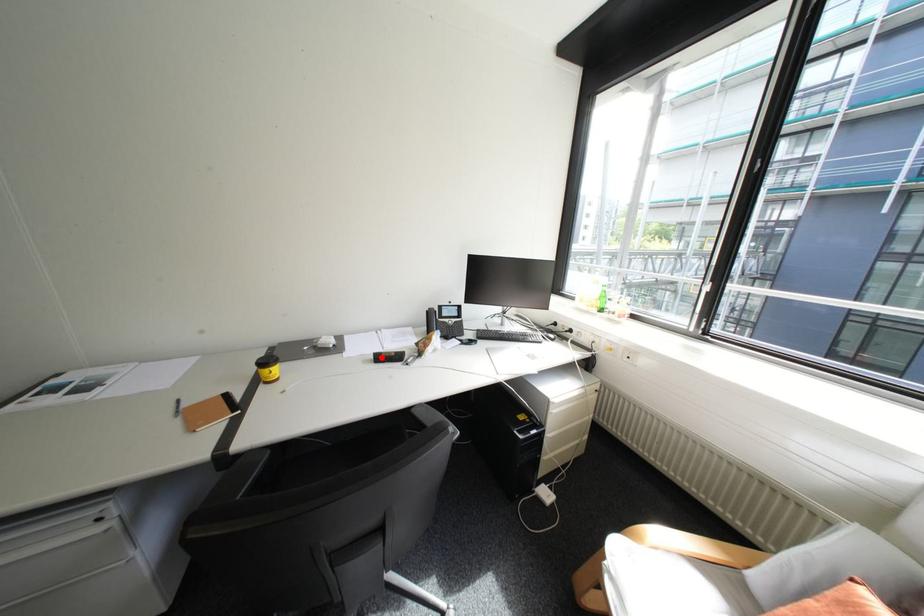
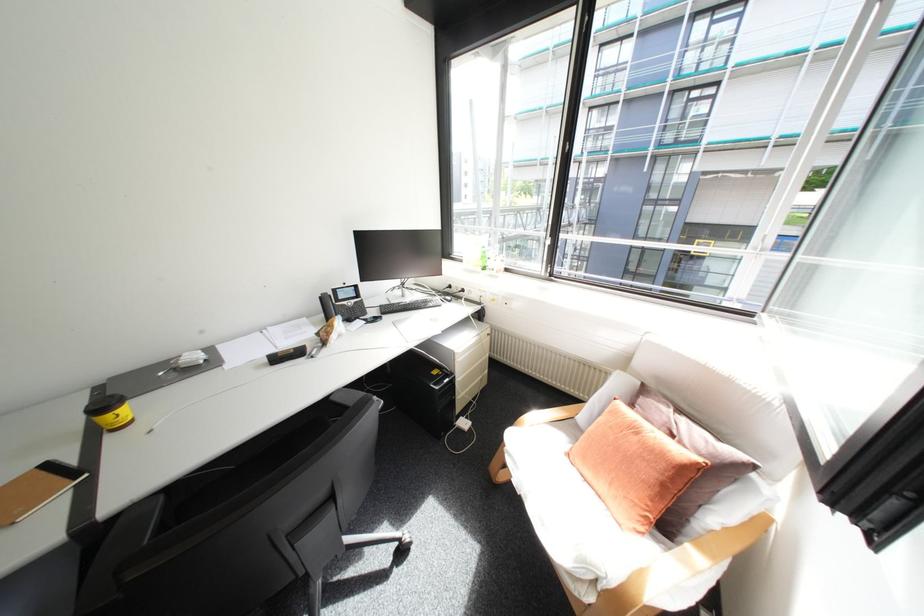
In the second image, find the point that corresponds to the highlighted location in the first image.

(275, 361)